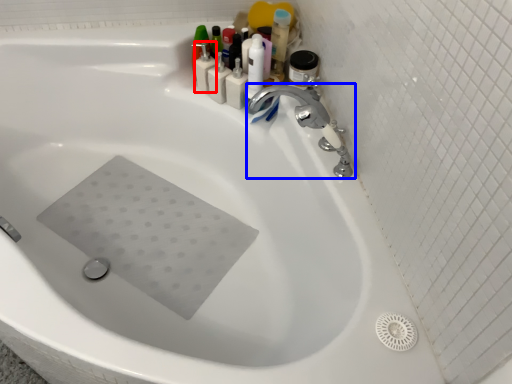
Question: Which object appears closest to the camera in this image, toiletry (highlighted by a red box) or tap (highlighted by a blue box)?

Choices:
 (A) toiletry
 (B) tap

Answer: (B)